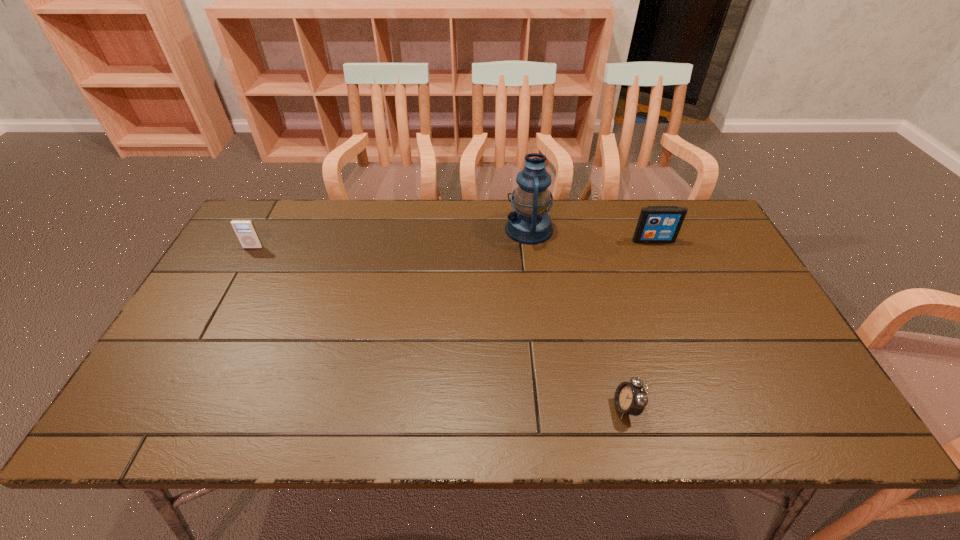
Where is `free spot that satisfies the following two spatial constraints: 1. on the face of the tallest object; 2. on the front-facing side of the left iPod`? free spot that satisfies the following two spatial constraints: 1. on the face of the tallest object; 2. on the front-facing side of the left iPod is located at coordinates 531,247.

Locate an element on the screen. free space that satisfies the following two spatial constraints: 1. on the front screen of the taller iPod; 2. on the face of the nearest object is located at coordinates (725, 407).

I want to click on free location that satisfies the following two spatial constraints: 1. on the front screen of the rightmost object; 2. on the face of the second object from right to left, so point(725,407).